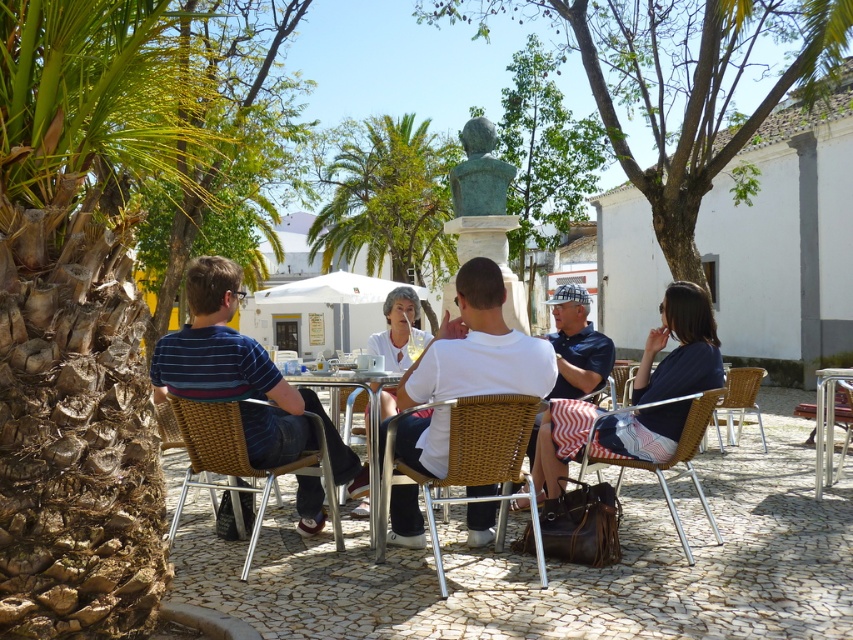
Is the position of woven wicker chair at center less distant than that of woven rattan chair at lower right?

Yes, woven wicker chair at center is closer to the viewer.

Which is in front, point (395, 432) or point (734, 390)?

Positioned in front is point (395, 432).

The image size is (853, 640). What do you see at coordinates (466, 460) in the screenshot?
I see `woven wicker chair at center` at bounding box center [466, 460].

The width and height of the screenshot is (853, 640). What are the coordinates of `woven wicker chair at center` in the screenshot? It's located at (466, 460).

Does blue denim shorts at center have a greater width compared to woven rattan chair at lower right?

Incorrect, blue denim shorts at center's width does not surpass woven rattan chair at lower right's.

Who is more forward, (581, 300) or (746, 401)?

Point (581, 300) is in front.

Locate an element on the screen. The height and width of the screenshot is (640, 853). blue denim shorts at center is located at coordinates (577, 344).

Does green leafy palm tree at center have a lesser width compared to woven rattan chair at lower right?

In fact, green leafy palm tree at center might be wider than woven rattan chair at lower right.

Does point (445, 186) come closer to viewer compared to point (728, 371)?

That is False.

Locate an element on the screen. The height and width of the screenshot is (640, 853). green leafy palm tree at center is located at coordinates (387, 200).